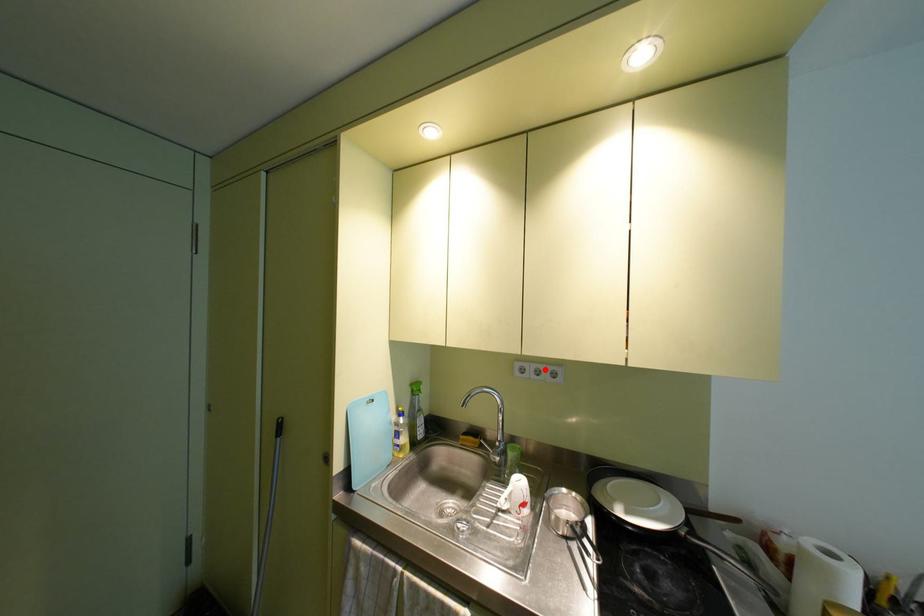
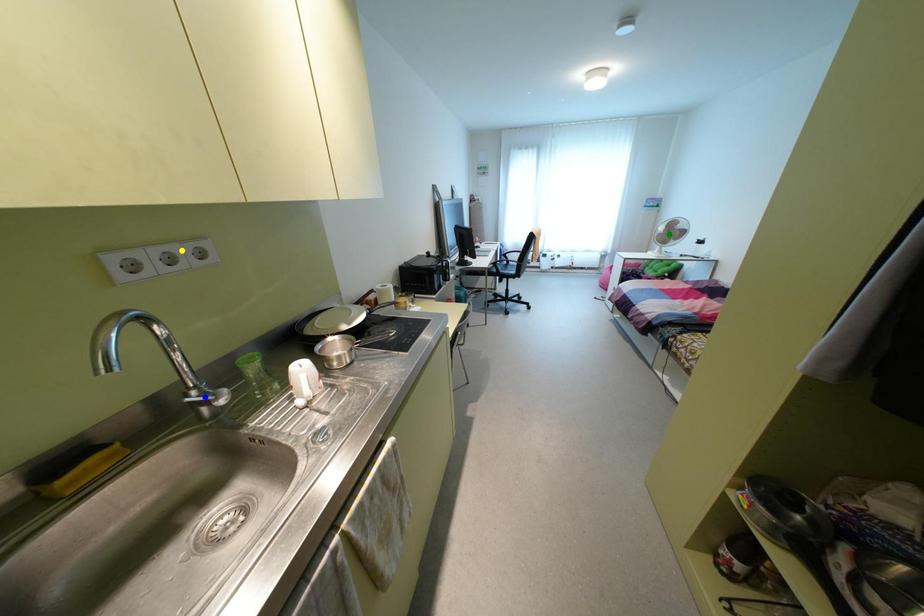
Question: I am providing you with two images of the same scene from different viewpoints. A red point is marked on the first image. You are given multiple points on the second image. Which spot in image 2 lines up with the point in image 1?

Choices:
 (A) yellow point
 (B) blue point
 (C) green point

Answer: (A)